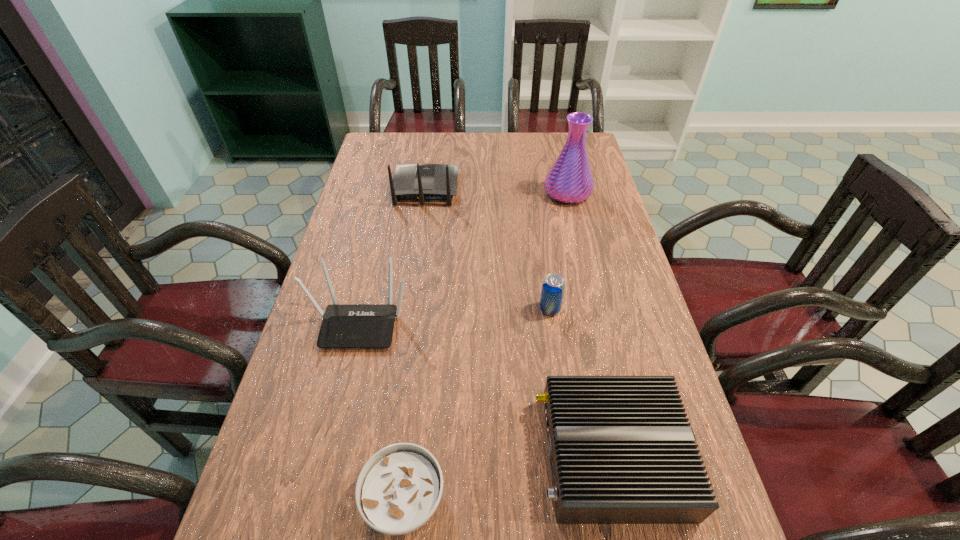
Image resolution: width=960 pixels, height=540 pixels. Find the location of `the tallest object`. the tallest object is located at coordinates (570, 180).

Identify the location of the farthest router. The height and width of the screenshot is (540, 960). (421, 182).

I want to click on the second nearest router, so click(344, 325).

Where is `beer can`? Image resolution: width=960 pixels, height=540 pixels. beer can is located at coordinates click(553, 287).

Locate an element on the screen. The height and width of the screenshot is (540, 960). the nearest router is located at coordinates (621, 449).

Where is `the rightmost router`? the rightmost router is located at coordinates (621, 449).

This screenshot has width=960, height=540. In order to click on vacant region located 0.290m on the front of the vase in this screenshot , I will do `click(586, 269)`.

Locate an element on the screen. This screenshot has height=540, width=960. vacant point located on the front-facing side of the farthest router is located at coordinates (433, 141).

Where is `vacant point located on the front-facing side of the farthest router`? Image resolution: width=960 pixels, height=540 pixels. vacant point located on the front-facing side of the farthest router is located at coordinates (433, 139).

This screenshot has width=960, height=540. Identify the location of vacant region located 0.160m on the front-facing side of the farthest router. (431, 149).